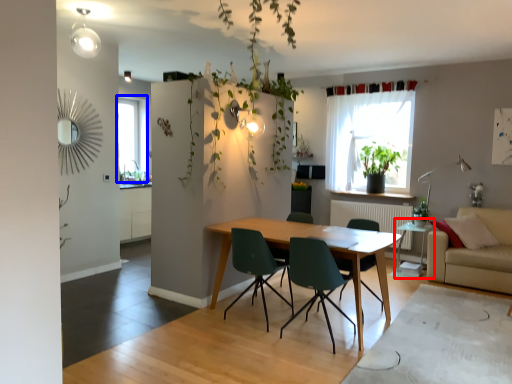
Question: Which object appears closest to the camera in this image, side table (highlighted by a red box) or window (highlighted by a blue box)?

Choices:
 (A) side table
 (B) window

Answer: (A)